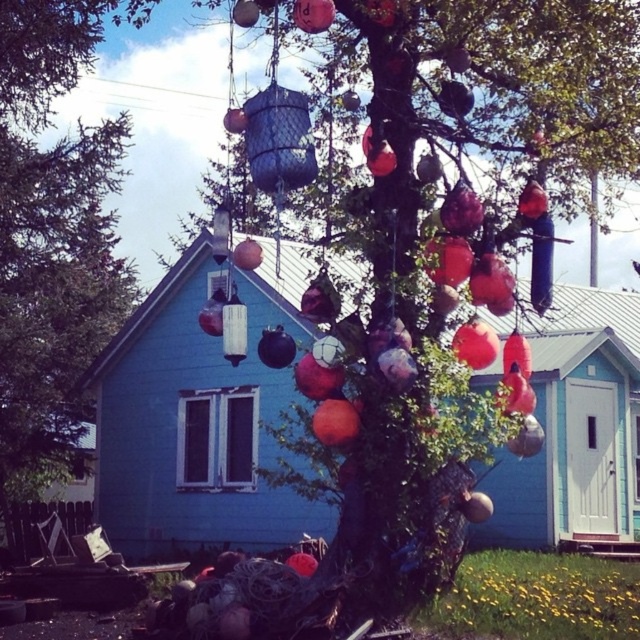
Question: Which object appears closest to the camera in this image?

Choices:
 (A) metallic mesh basket at center
 (B) green matte tree at center

Answer: (A)

Question: Where is metallic mesh basket at center located in relation to green matte tree at center in the image?

Choices:
 (A) above
 (B) below

Answer: (B)

Question: Which point appears closest to the camera in this image?

Choices:
 (A) (106, 1)
 (B) (275, 108)

Answer: (B)

Question: Is metallic mesh basket at center wider than green matte tree at center?

Choices:
 (A) yes
 (B) no

Answer: (B)

Question: Which point is farther to the camera?

Choices:
 (A) (13, 156)
 (B) (422, 371)

Answer: (A)

Question: Does metallic mesh basket at center appear on the left side of green matte tree at center?

Choices:
 (A) no
 (B) yes

Answer: (A)